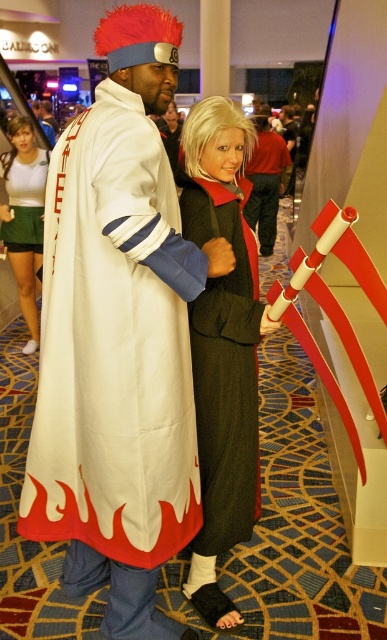
Does green wool coat at center have a lesser height compared to matte black jacket at center?

Yes.

Which is below, green wool coat at center or matte black jacket at center?

green wool coat at center is below.

Between point (215, 180) and point (277, 211), which one is positioned in front?

Point (215, 180) is more forward.

What are the coordinates of `green wool coat at center` in the screenshot? It's located at (222, 344).

Between white matte cape at center and matte green skirt at lower left, which one appears on the right side from the viewer's perspective?

From the viewer's perspective, white matte cape at center appears more on the right side.

Between point (135, 476) and point (8, 173), which one is positioned in front?

Point (135, 476) is in front.

This screenshot has height=640, width=387. I want to click on white matte cape at center, so click(118, 339).

Does green wool coat at center appear on the left side of matte green skirt at lower left?

Incorrect, green wool coat at center is not on the left side of matte green skirt at lower left.

Who is more distant from viewer, (x=210, y=124) or (x=27, y=348)?

The point (x=27, y=348) is more distant.

Find the location of a particular element. green wool coat at center is located at coordinates (222, 344).